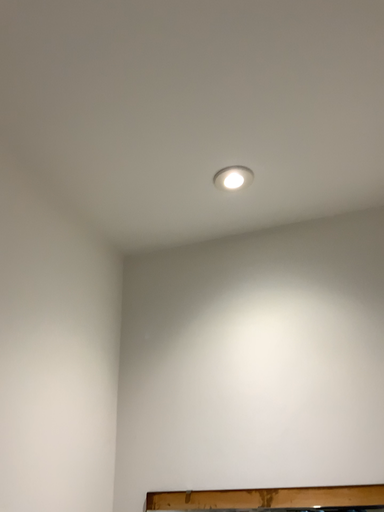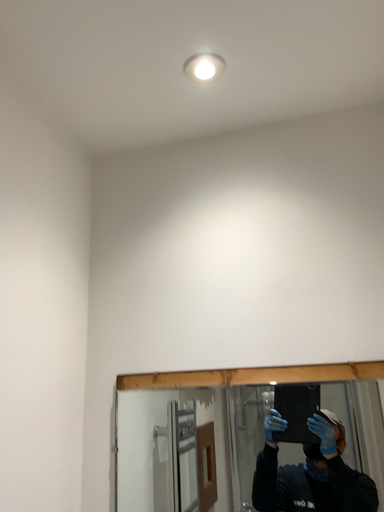
Question: How did the camera likely rotate when shooting the video?

Choices:
 (A) rotated downward
 (B) rotated upward

Answer: (A)